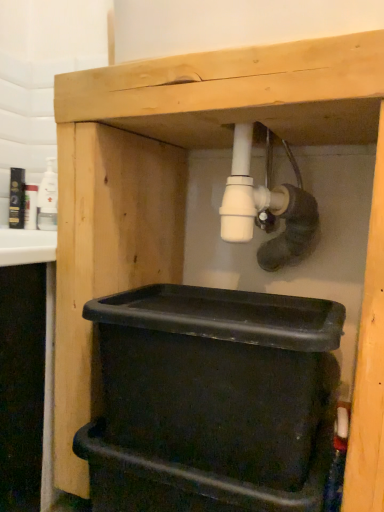
Consider the image. Measure the distance between point (48, 212) and camera.

Point (48, 212) and camera are 1.56 meters apart from each other.

The image size is (384, 512). What do you see at coordinates (48, 199) in the screenshot?
I see `white glossy bottle at upper left` at bounding box center [48, 199].

Locate an element on the screen. white glossy bottle at upper left is located at coordinates (48, 199).

In order to face black plastic bin at lower center, should I rotate leftwards or rightwards?

To face it directly, rotate right by 3.233 degrees.

The height and width of the screenshot is (512, 384). What do you see at coordinates (212, 401) in the screenshot?
I see `black plastic bin at lower center` at bounding box center [212, 401].

What is the approximate width of black plastic bin at lower center?

black plastic bin at lower center is 11.53 inches in width.

I want to click on black plastic bin at lower center, so click(x=212, y=401).

Where is `white glossy bottle at upper left`? Image resolution: width=384 pixels, height=512 pixels. white glossy bottle at upper left is located at coordinates (48, 199).

Based on their positions, is black plastic bin at lower center located to the left or right of white glossy bottle at upper left?

In the image, black plastic bin at lower center appears on the right side of white glossy bottle at upper left.

Looking at this image, considering the relative positions of black plastic bin at lower center and white glossy bottle at upper left in the image provided, is black plastic bin at lower center behind white glossy bottle at upper left?

No, it is not.

Does point (214, 509) appear closer or farther from the camera than point (42, 203)?

Point (214, 509) appears to be closer to the viewer than point (42, 203).

From the image's perspective, is black plastic bin at lower center above or below white glossy bottle at upper left?

black plastic bin at lower center is below white glossy bottle at upper left.

From a real-world perspective, is black plastic bin at lower center over white glossy bottle at upper left?

No, from a real-world perspective, black plastic bin at lower center is not above white glossy bottle at upper left.

Consider the image. In terms of width, does black plastic bin at lower center look wider or thinner when compared to white glossy bottle at upper left?

Considering their sizes, black plastic bin at lower center looks broader than white glossy bottle at upper left.

Considering the relative sizes of black plastic bin at lower center and white glossy bottle at upper left in the image provided, is black plastic bin at lower center shorter than white glossy bottle at upper left?

Incorrect, the height of black plastic bin at lower center does not fall short of that of white glossy bottle at upper left.

Considering the sizes of black plastic bin at lower center and white glossy bottle at upper left in the image, is black plastic bin at lower center bigger or smaller than white glossy bottle at upper left?

Clearly, black plastic bin at lower center is larger in size than white glossy bottle at upper left.

Choose the correct answer: Is black plastic bin at lower center inside white glossy bottle at upper left or outside it?

black plastic bin at lower center is located beyond the bounds of white glossy bottle at upper left.

Is black plastic bin at lower center not close to white glossy bottle at upper left?

Absolutely, black plastic bin at lower center is distant from white glossy bottle at upper left.

Is black plastic bin at lower center facing away from white glossy bottle at upper left?

That's not correct — black plastic bin at lower center is not looking away from white glossy bottle at upper left.

In the scene shown: How many degrees apart are the facing directions of black plastic bin at lower center and white glossy bottle at upper left?

The angle between the facing direction of black plastic bin at lower center and the facing direction of white glossy bottle at upper left is 0.615 degrees.

Where is `recycling bin below the white glossy bottle at upper left (from a real-world perspective)`? The image size is (384, 512). recycling bin below the white glossy bottle at upper left (from a real-world perspective) is located at coordinates (212, 401).

Is white glossy bottle at upper left to the right of black plastic bin at lower center from the viewer's perspective?

Incorrect, white glossy bottle at upper left is not on the right side of black plastic bin at lower center.

Based on the photo, in the image, is white glossy bottle at upper left positioned in front of or behind black plastic bin at lower center?

Clearly, white glossy bottle at upper left is behind black plastic bin at lower center.

Which point is more forward, (52, 220) or (114, 444)?

The point (114, 444) is closer.

From the image's perspective, who appears lower, white glossy bottle at upper left or black plastic bin at lower center?

black plastic bin at lower center appears lower in the image.

From a real-world perspective, is white glossy bottle at upper left below black plastic bin at lower center?

Incorrect, from a real-world perspective, white glossy bottle at upper left is higher than black plastic bin at lower center.

Is white glossy bottle at upper left wider than black plastic bin at lower center?

No.

In the scene shown: In terms of height, does white glossy bottle at upper left look taller or shorter compared to black plastic bin at lower center?

In the image, white glossy bottle at upper left appears to be shorter than black plastic bin at lower center.

Can you confirm if white glossy bottle at upper left is smaller than black plastic bin at lower center?

Correct, white glossy bottle at upper left occupies less space than black plastic bin at lower center.

Is white glossy bottle at upper left completely or partially outside of black plastic bin at lower center?

Indeed, white glossy bottle at upper left is completely outside black plastic bin at lower center.

Are white glossy bottle at upper left and black plastic bin at lower center making contact?

There is a gap between white glossy bottle at upper left and black plastic bin at lower center.

Is white glossy bottle at upper left oriented towards black plastic bin at lower center?

No, white glossy bottle at upper left is not turned towards black plastic bin at lower center.

What's the angular difference between white glossy bottle at upper left and black plastic bin at lower center's facing directions?

white glossy bottle at upper left and black plastic bin at lower center are facing 0.615 degrees away from each other.

How much distance is there between white glossy bottle at upper left and black plastic bin at lower center?

The distance of white glossy bottle at upper left from black plastic bin at lower center is 1.04 meters.

This screenshot has height=512, width=384. Find the location of `recycling bin lying in front of the white glossy bottle at upper left`. recycling bin lying in front of the white glossy bottle at upper left is located at coordinates (212, 401).

This screenshot has height=512, width=384. In order to click on recycling bin on the right of white glossy bottle at upper left in this screenshot , I will do `click(212, 401)`.

The width and height of the screenshot is (384, 512). What are the coordinates of `bottle above the black plastic bin at lower center (from a real-world perspective)` in the screenshot? It's located at (48, 199).